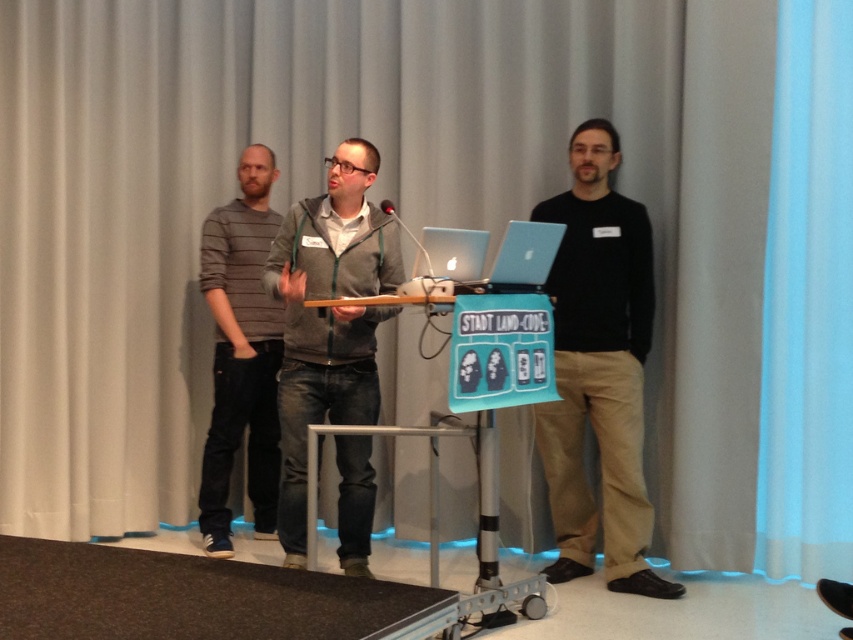
Can you confirm if black matte shirt at right is positioned to the right of silver metallic laptop at center?

Correct, you'll find black matte shirt at right to the right of silver metallic laptop at center.

Is black matte shirt at right wider than silver metallic laptop at center?

Indeed, black matte shirt at right has a greater width compared to silver metallic laptop at center.

Does point (560, 291) come behind point (497, 266)?

That is True.

This screenshot has height=640, width=853. Identify the location of black matte shirt at right. (598, 369).

Does jeans at center have a greater width compared to sleek silver laptop at center?

Indeed, jeans at center has a greater width compared to sleek silver laptop at center.

Which is more to the left, jeans at center or sleek silver laptop at center?

jeans at center is more to the left.

The width and height of the screenshot is (853, 640). What do you see at coordinates (328, 317) in the screenshot?
I see `jeans at center` at bounding box center [328, 317].

The height and width of the screenshot is (640, 853). What are the coordinates of `jeans at center` in the screenshot? It's located at (328, 317).

Does black matte shirt at right come in front of sleek silver laptop at center?

No, it is behind sleek silver laptop at center.

Which is in front, point (625, 204) or point (482, 248)?

Point (482, 248)

What do you see at coordinates (598, 369) in the screenshot?
I see `black matte shirt at right` at bounding box center [598, 369].

Locate an element on the screen. black matte shirt at right is located at coordinates (598, 369).